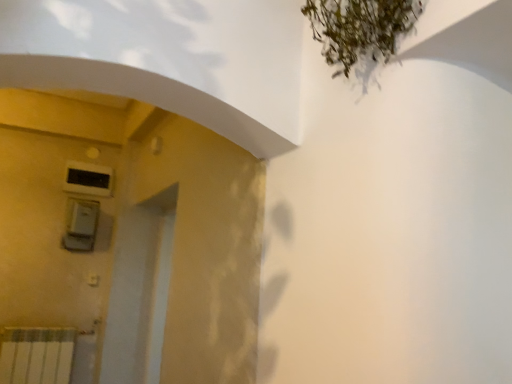
Question: Is black plastic air conditioning unit at upper left directly adjacent to satin silver switch at left?

Choices:
 (A) no
 (B) yes

Answer: (A)

Question: Can you confirm if black plastic air conditioning unit at upper left is positioned to the left of satin silver switch at left?

Choices:
 (A) yes
 (B) no

Answer: (A)

Question: Is black plastic air conditioning unit at upper left positioned behind satin silver switch at left?

Choices:
 (A) no
 (B) yes

Answer: (B)

Question: Does black plastic air conditioning unit at upper left have a smaller size compared to satin silver switch at left?

Choices:
 (A) no
 (B) yes

Answer: (B)

Question: Is black plastic air conditioning unit at upper left looking in the opposite direction of satin silver switch at left?

Choices:
 (A) no
 (B) yes

Answer: (A)

Question: Considering the relative positions of black plastic air conditioning unit at upper left and satin silver switch at left in the image provided, is black plastic air conditioning unit at upper left to the right of satin silver switch at left from the viewer's perspective?

Choices:
 (A) yes
 (B) no

Answer: (B)

Question: Is satin silver switch at left taller than black plastic air conditioning unit at upper left?

Choices:
 (A) yes
 (B) no

Answer: (A)

Question: Does satin silver switch at left lie in front of black plastic air conditioning unit at upper left?

Choices:
 (A) no
 (B) yes

Answer: (B)

Question: Is the position of satin silver switch at left more distant than that of black plastic air conditioning unit at upper left?

Choices:
 (A) yes
 (B) no

Answer: (B)

Question: Is satin silver switch at left not near black plastic air conditioning unit at upper left?

Choices:
 (A) yes
 (B) no

Answer: (B)

Question: Considering the relative sizes of satin silver switch at left and black plastic air conditioning unit at upper left in the image provided, is satin silver switch at left shorter than black plastic air conditioning unit at upper left?

Choices:
 (A) yes
 (B) no

Answer: (B)

Question: Considering the relative sizes of satin silver switch at left and black plastic air conditioning unit at upper left in the image provided, is satin silver switch at left bigger than black plastic air conditioning unit at upper left?

Choices:
 (A) yes
 (B) no

Answer: (A)

Question: Is black plastic air conditioning unit at upper left taller or shorter than satin silver switch at left?

Choices:
 (A) short
 (B) tall

Answer: (A)